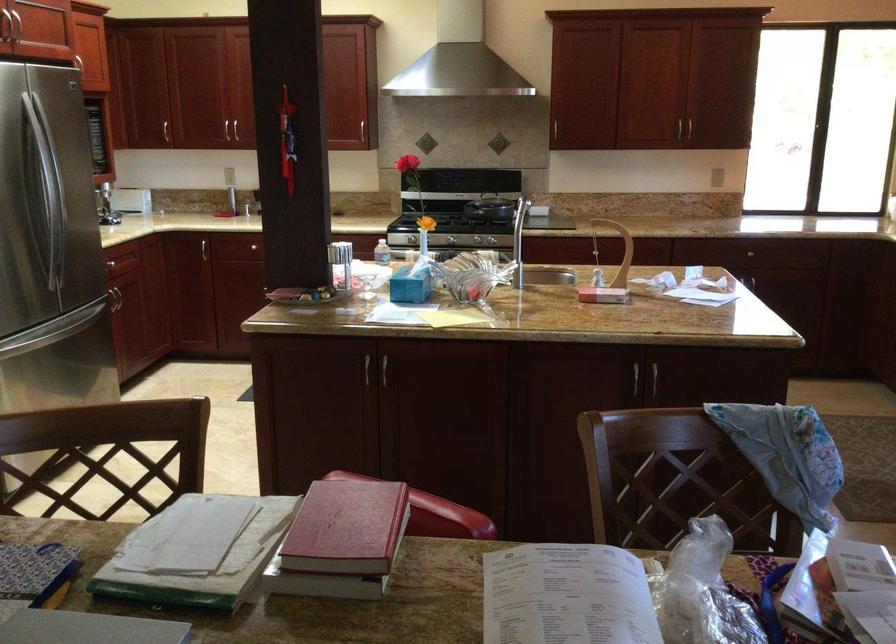
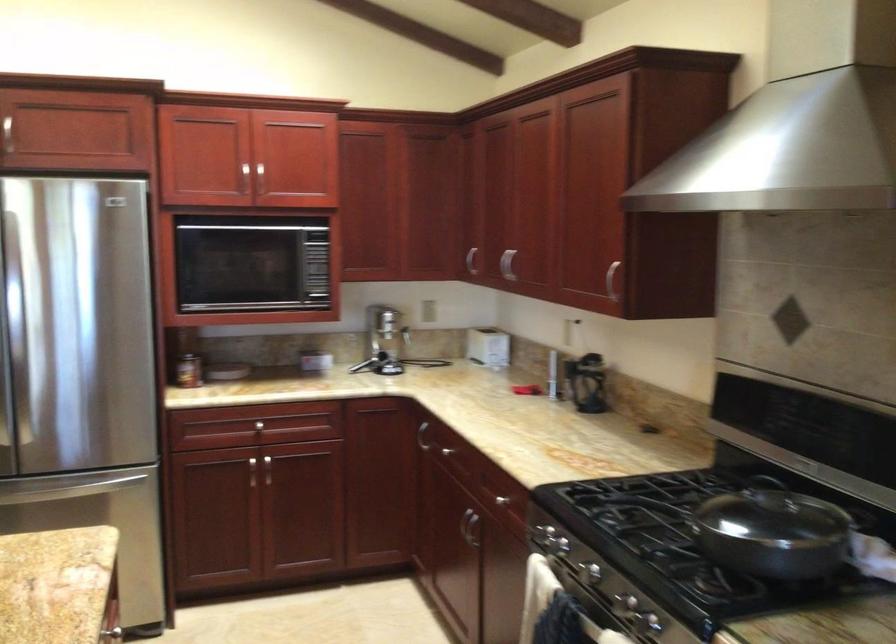
The point at (188, 120) is marked in the first image. Where is the corresponding point in the second image?

(506, 263)